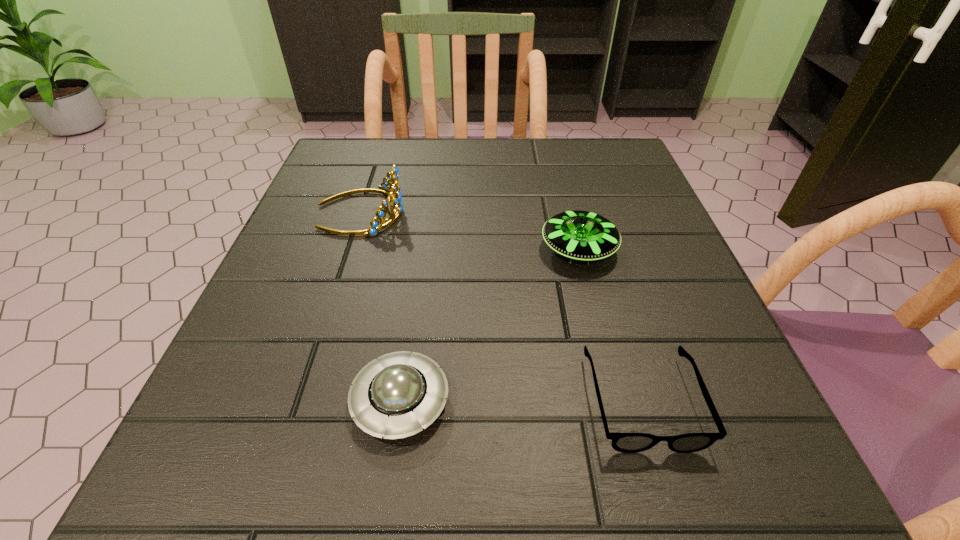
Locate an element on the screen. tiara is located at coordinates 392,177.

Locate an element on the screen. This screenshot has width=960, height=540. the farther saucer is located at coordinates (580, 235).

Locate an element on the screen. This screenshot has width=960, height=540. the right saucer is located at coordinates (580, 235).

The width and height of the screenshot is (960, 540). What are the coordinates of `the left saucer` in the screenshot? It's located at (394, 396).

Locate an element on the screen. the nearer saucer is located at coordinates (394, 396).

In order to click on the shortest object in this screenshot , I will do `click(623, 442)`.

Identify the location of vacant space located on the front-facing side of the tallest object. (558, 212).

Identify the location of free space located 0.130m on the left of the right saucer. The image size is (960, 540). (468, 249).

In order to click on vacant space located on the back of the shorter saucer in this screenshot , I will do `click(425, 231)`.

Where is `object at the far edge`? The width and height of the screenshot is (960, 540). object at the far edge is located at coordinates (392, 177).